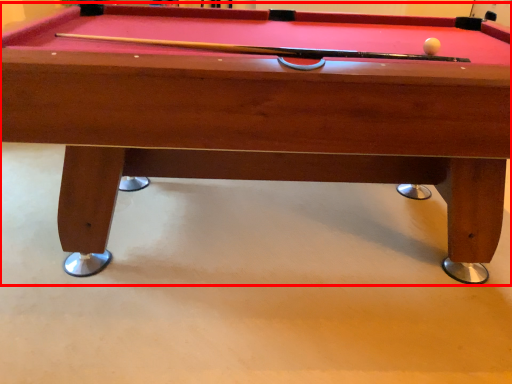
Question: Considering the relative positions of billiard table (annotated by the red box) and ball in the image provided, where is billiard table (annotated by the red box) located with respect to the staircase?

Choices:
 (A) right
 (B) left

Answer: (B)